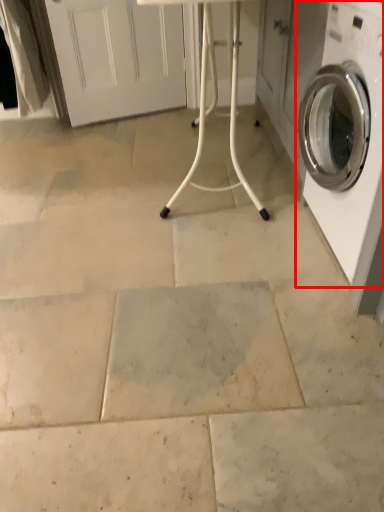
Question: From the image's perspective, where is washing machine (annotated by the red box) located relative to table?

Choices:
 (A) above
 (B) below

Answer: (B)